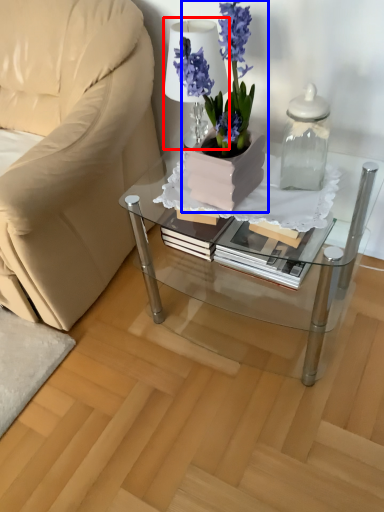
Question: Among these objects, which one is farthest to the camera, table lamp (highlighted by a red box) or houseplant (highlighted by a blue box)?

Choices:
 (A) table lamp
 (B) houseplant

Answer: (A)